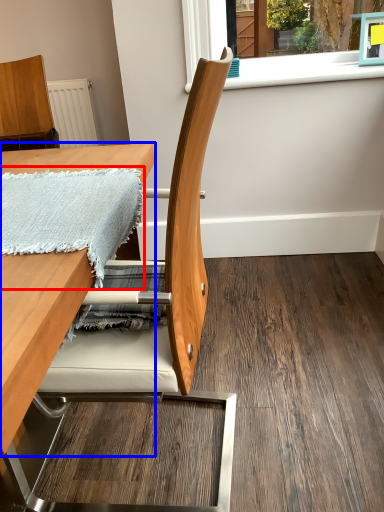
Question: Which object appears farthest to the camera in this image, blanket (highlighted by a red box) or table (highlighted by a blue box)?

Choices:
 (A) blanket
 (B) table

Answer: (A)